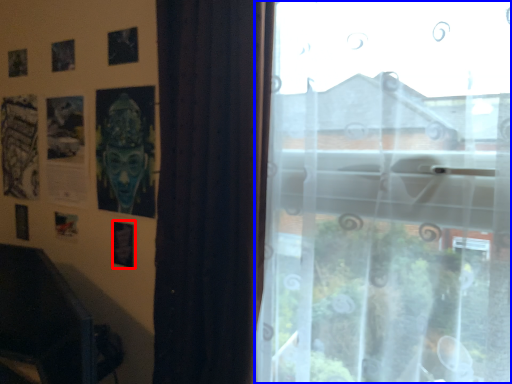
Question: Which point is closer to the camera, picture frame (highlighted by a red box) or window (highlighted by a blue box)?

Choices:
 (A) picture frame
 (B) window

Answer: (B)